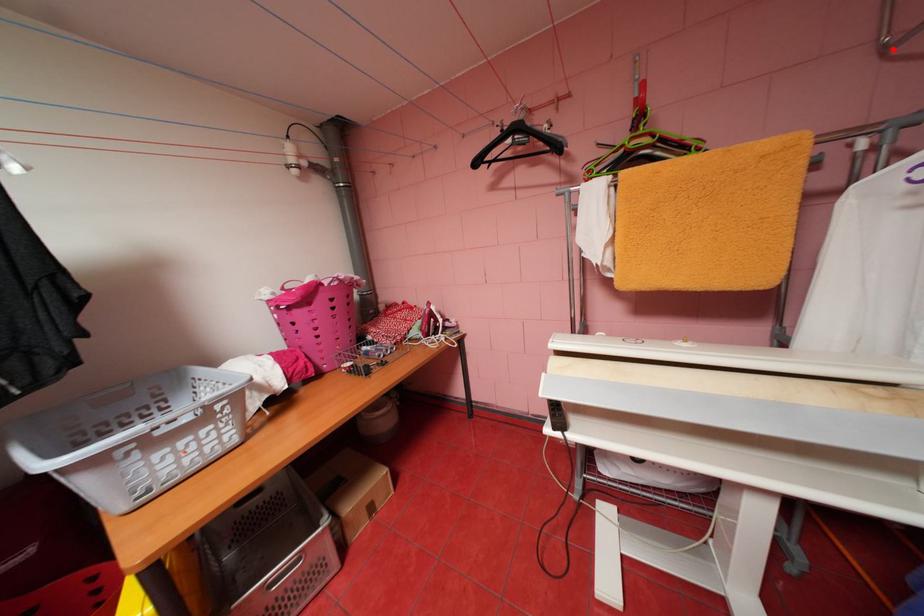
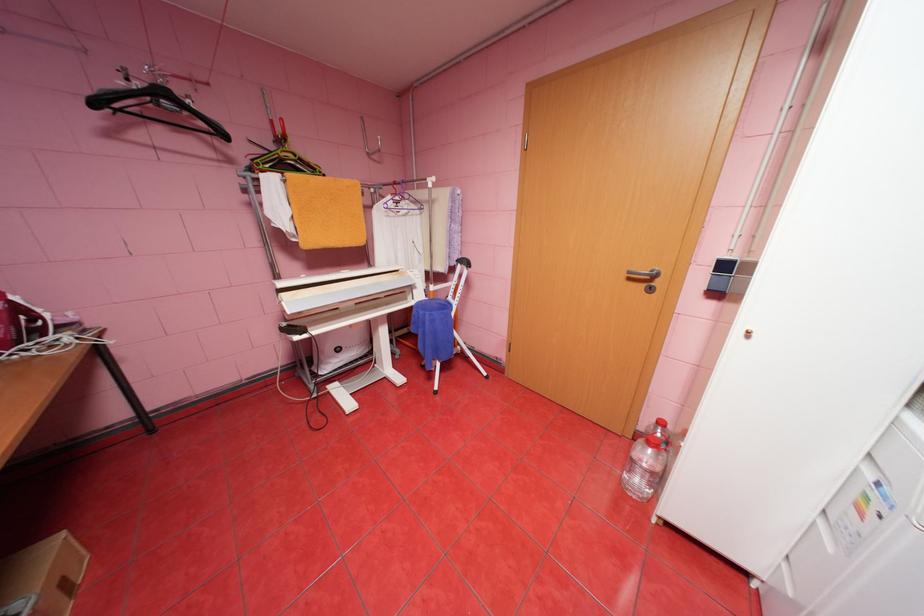
Question: I am providing you with two images of the same scene from different viewpoints. Image1 has a red point marked. In image2, the corresponding 3D location appears at what relative position? Reply with the corresponding letter.

Choices:
 (A) Closer
 (B) Farther

Answer: (A)